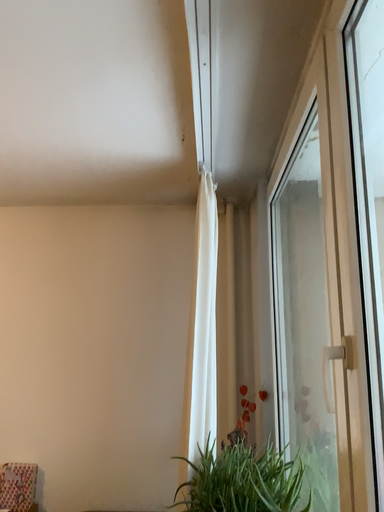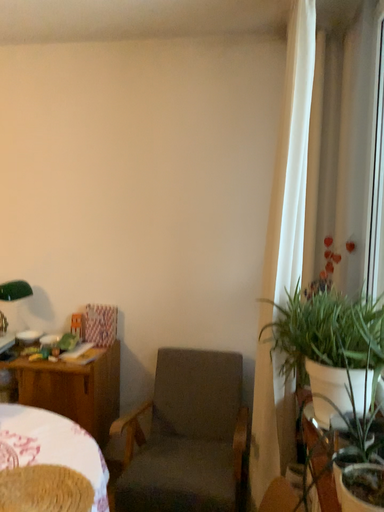
Question: How did the camera likely rotate when shooting the video?

Choices:
 (A) rotated upward
 (B) rotated downward

Answer: (B)